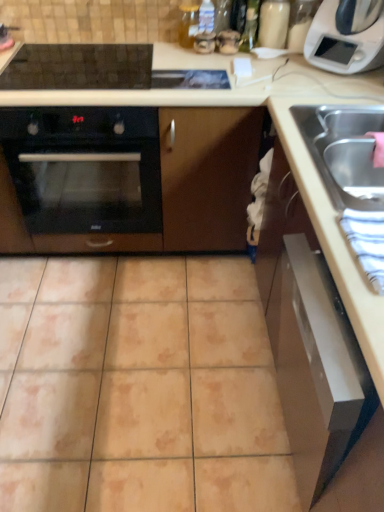
Question: Is beige ceramic tile at center positioned in front of black glass oven at left?

Choices:
 (A) no
 (B) yes

Answer: (B)

Question: Can you confirm if beige ceramic tile at center is shorter than black glass oven at left?

Choices:
 (A) yes
 (B) no

Answer: (A)

Question: Is beige ceramic tile at center positioned with its back to black glass oven at left?

Choices:
 (A) no
 (B) yes

Answer: (A)

Question: Is beige ceramic tile at center at the right side of black glass oven at left?

Choices:
 (A) no
 (B) yes

Answer: (B)

Question: Would you say beige ceramic tile at center is a long distance from black glass oven at left?

Choices:
 (A) no
 (B) yes

Answer: (A)

Question: Is point (74, 169) positioned closer to the camera than point (339, 12)?

Choices:
 (A) farther
 (B) closer

Answer: (A)

Question: From the image's perspective, relative to white plastic microwave at upper right, is black glass oven at left above or below?

Choices:
 (A) below
 (B) above

Answer: (A)

Question: Considering the positions of black glass oven at left and white plastic microwave at upper right in the image, is black glass oven at left bigger or smaller than white plastic microwave at upper right?

Choices:
 (A) big
 (B) small

Answer: (A)

Question: Is black glass oven at left taller or shorter than white plastic microwave at upper right?

Choices:
 (A) tall
 (B) short

Answer: (A)

Question: From a real-world perspective, is white plastic microwave at upper right above or below satin silver drawer at lower right?

Choices:
 (A) below
 (B) above

Answer: (B)

Question: Does point pyautogui.click(x=309, y=46) appear closer or farther from the camera than point pyautogui.click(x=362, y=416)?

Choices:
 (A) farther
 (B) closer

Answer: (A)

Question: Based on their sizes in the image, would you say white plastic microwave at upper right is bigger or smaller than satin silver drawer at lower right?

Choices:
 (A) small
 (B) big

Answer: (A)

Question: From the image's perspective, relative to satin silver drawer at lower right, is white plastic microwave at upper right above or below?

Choices:
 (A) above
 (B) below

Answer: (A)

Question: Is black glass oven at left wider or thinner than beige ceramic tile at center?

Choices:
 (A) wide
 (B) thin

Answer: (B)

Question: Would you say black glass oven at left is to the left or to the right of beige ceramic tile at center in the picture?

Choices:
 (A) right
 (B) left

Answer: (B)